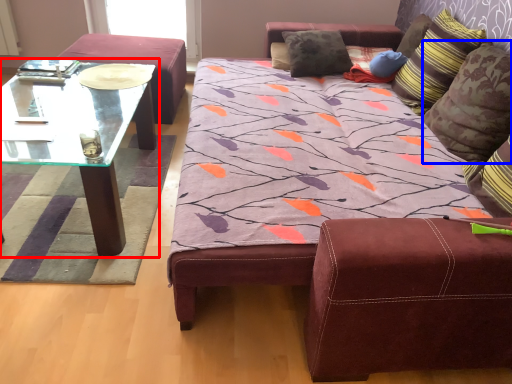
Question: Which point is further to the camera, coffee table (highlighted by a red box) or pillow (highlighted by a blue box)?

Choices:
 (A) coffee table
 (B) pillow

Answer: (A)